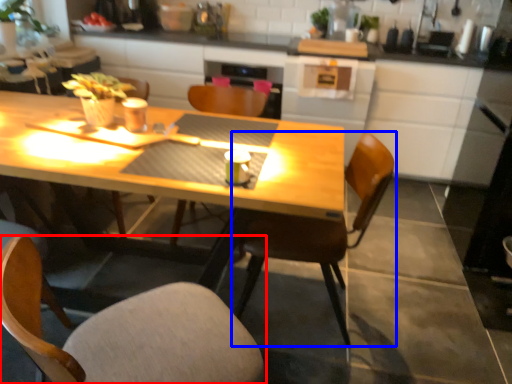
Question: Among these objects, which one is farthest to the camera, chair (highlighted by a red box) or chair (highlighted by a blue box)?

Choices:
 (A) chair
 (B) chair

Answer: (B)